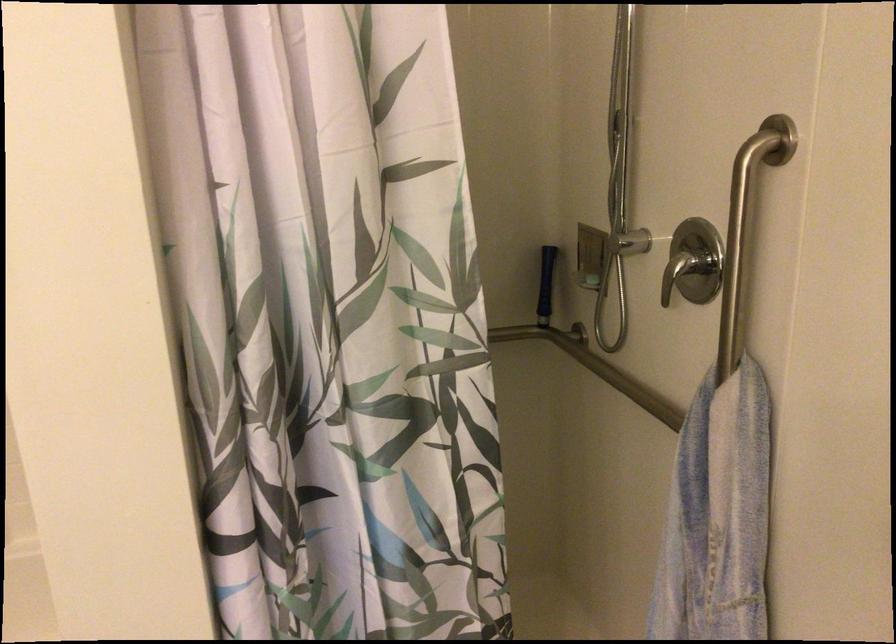
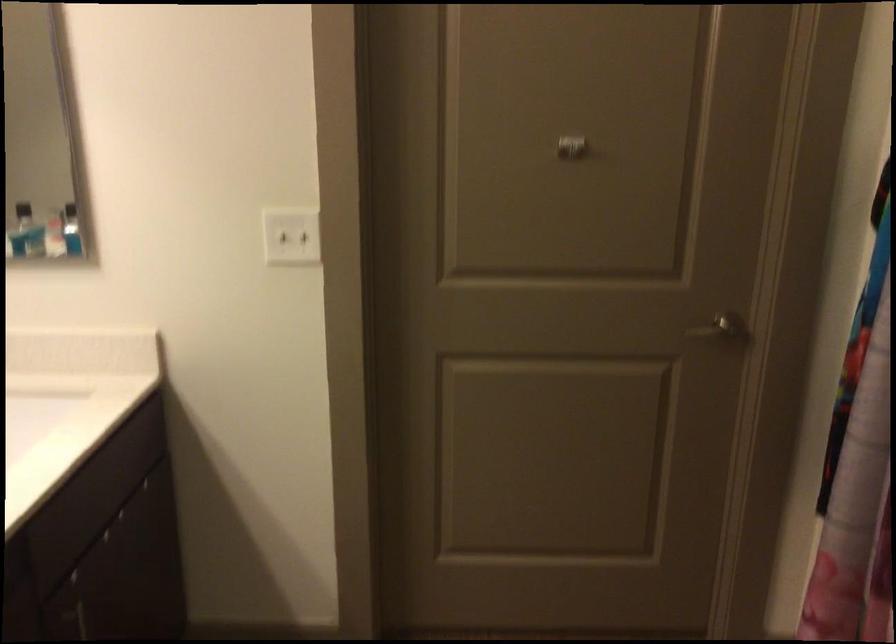
Based on the continuous images, in which direction is the camera rotating?

The camera's rotation is toward left-down.